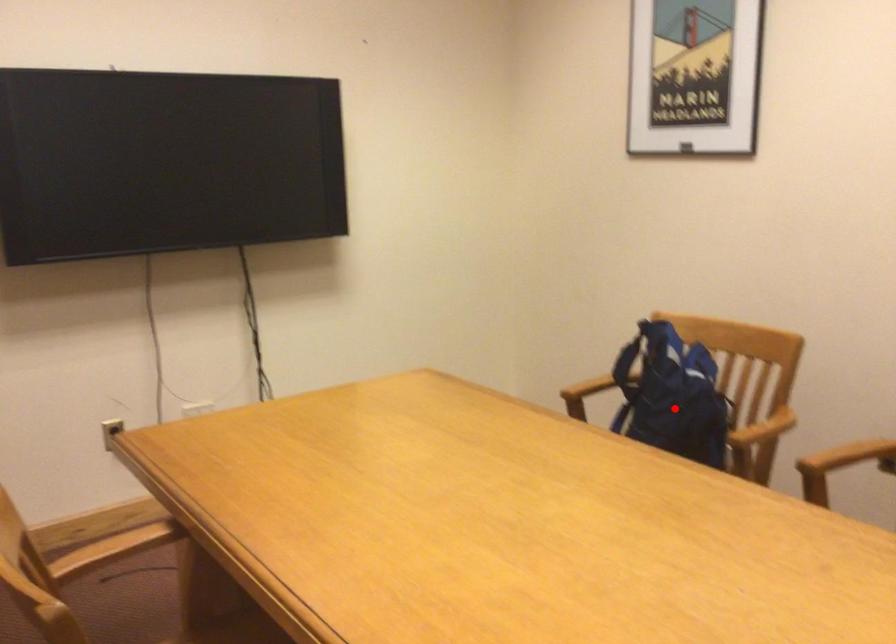
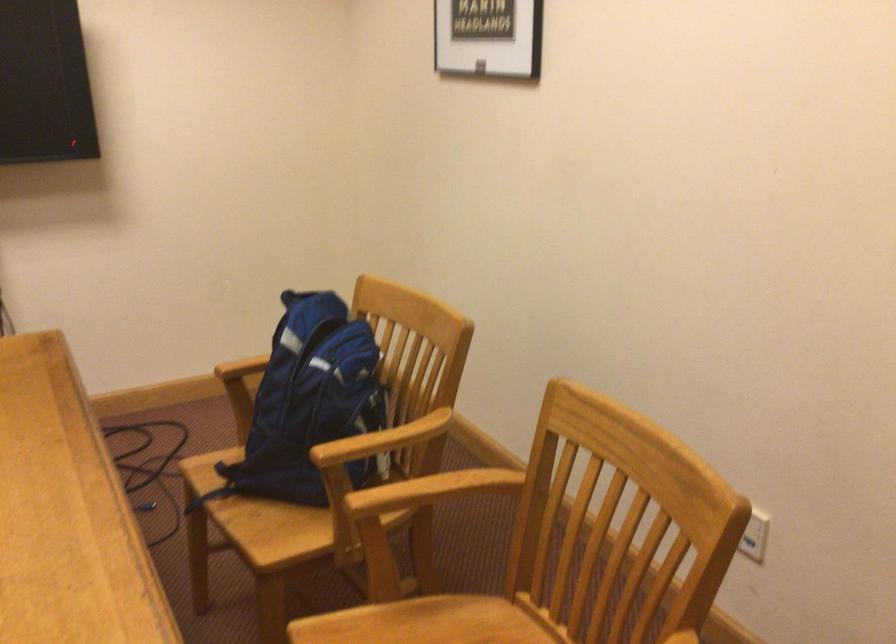
Question: A red point is marked in image1. In image2, is the corresponding 3D point closer to the camera or farther? Reply with the corresponding letter.

Choices:
 (A) The corresponding 3D point is closer.
 (B) The corresponding 3D point is farther.

Answer: (A)